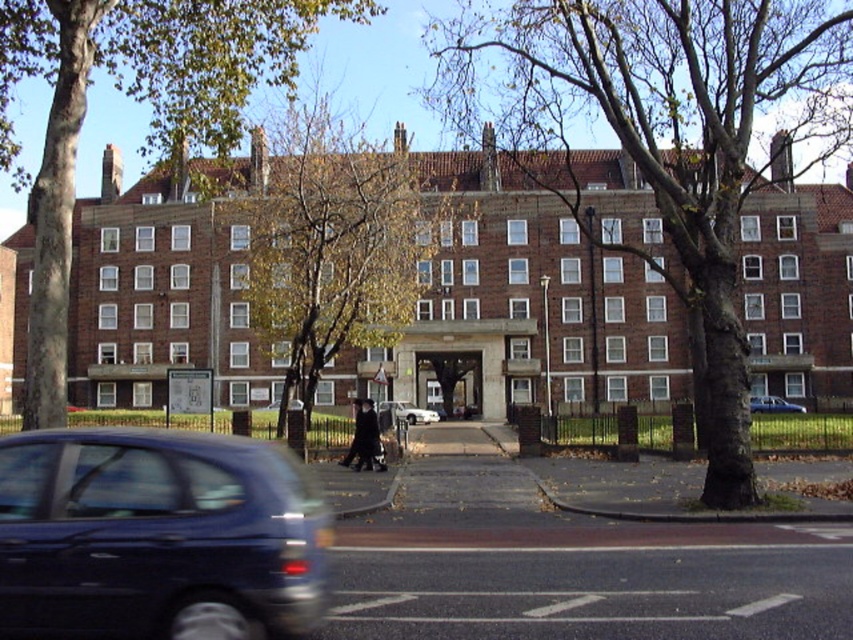
You are standing at the central entranceway with a stone archway of the building. You see a point marked at coordinates (672, 140). What object does this point correspond to?

The point corresponds to the smooth bark tree at center.

You are a delivery driver approaching the building and need to park your vehicle. There are two cars already parked at the center of the paved area. Which car is closer to the entrance when viewed from the sidewalk? Please choose between the white glossy sedan at center and the blue metallic car at center.

The white glossy sedan at center is to the left of the blue metallic car at center. Since the entrance is centrally located, the white glossy sedan at center would be closer to the entrance as it is positioned to the left, which is closer to the central entranceway.